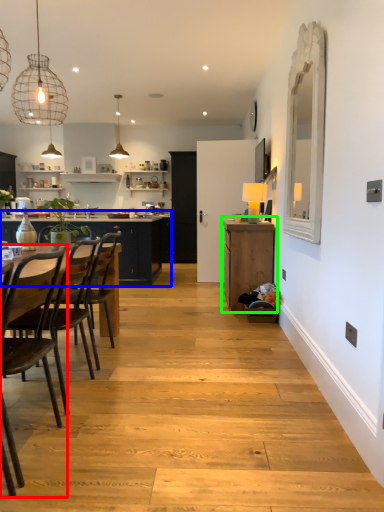
Question: Which object is positioned closest to chair (highlighted by a red box)? Select from countertop (highlighted by a blue box) and cabinetry (highlighted by a green box).

Choices:
 (A) countertop
 (B) cabinetry

Answer: (B)